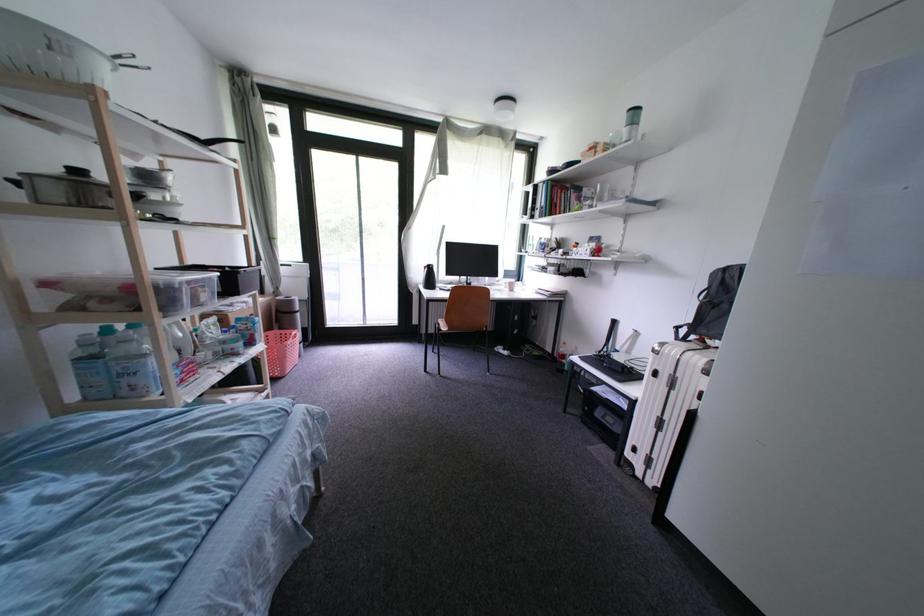
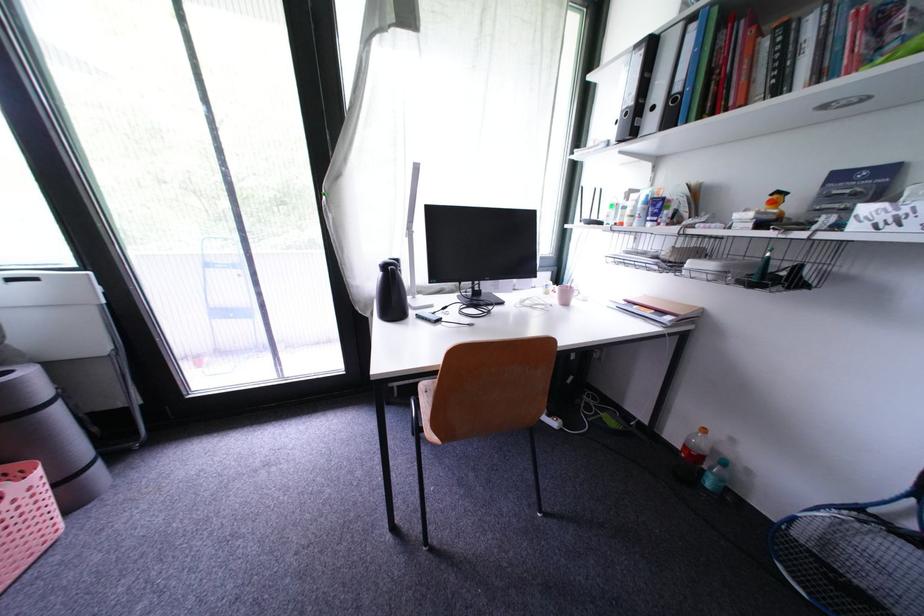
Locate, in the second image, the point that corresponds to the point at 438,272 in the first image.

(398, 274)